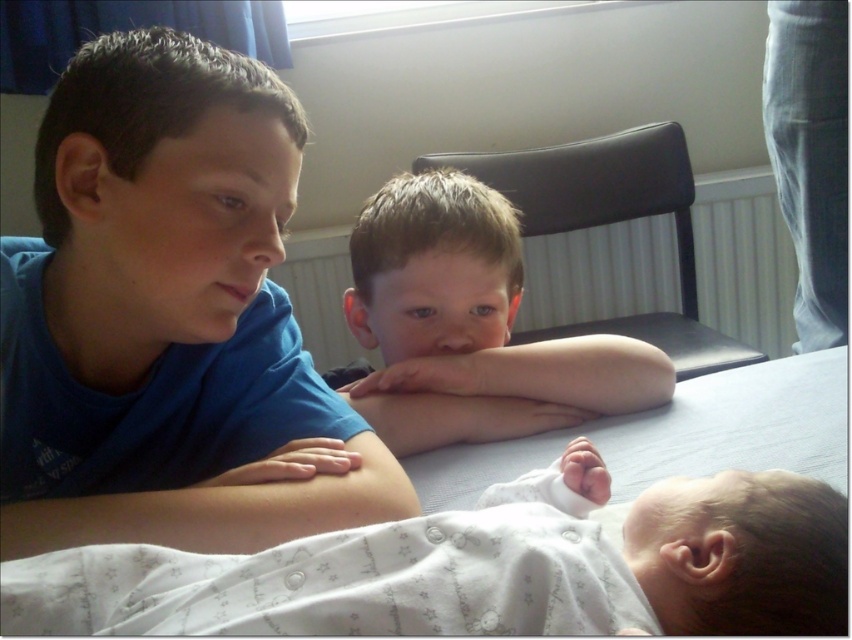
Question: From the image, what is the correct spatial relationship of blue cotton shirt at upper left in relation to white soft fabric baby at lower center?

Choices:
 (A) below
 (B) above

Answer: (B)

Question: Where is blue cotton shirt at upper left located in relation to white soft fabric baby at lower center in the image?

Choices:
 (A) above
 (B) below

Answer: (A)

Question: Based on their relative distances, which object is nearer to the light brown skin at center?

Choices:
 (A) white soft fabric baby at lower center
 (B) blue cotton shirt at upper left
 (C) smooth skin arm at center

Answer: (C)

Question: Which of the following is the farthest from the observer?

Choices:
 (A) (586, 348)
 (B) (262, 595)
 (C) (70, 396)

Answer: (A)

Question: Estimate the real-world distances between objects in this image. Which object is farther from the smooth skin arm at center?

Choices:
 (A) blue cotton shirt at upper left
 (B) light brown skin at center

Answer: (A)

Question: Is blue cotton shirt at upper left to the left of light brown skin at center from the viewer's perspective?

Choices:
 (A) yes
 (B) no

Answer: (A)